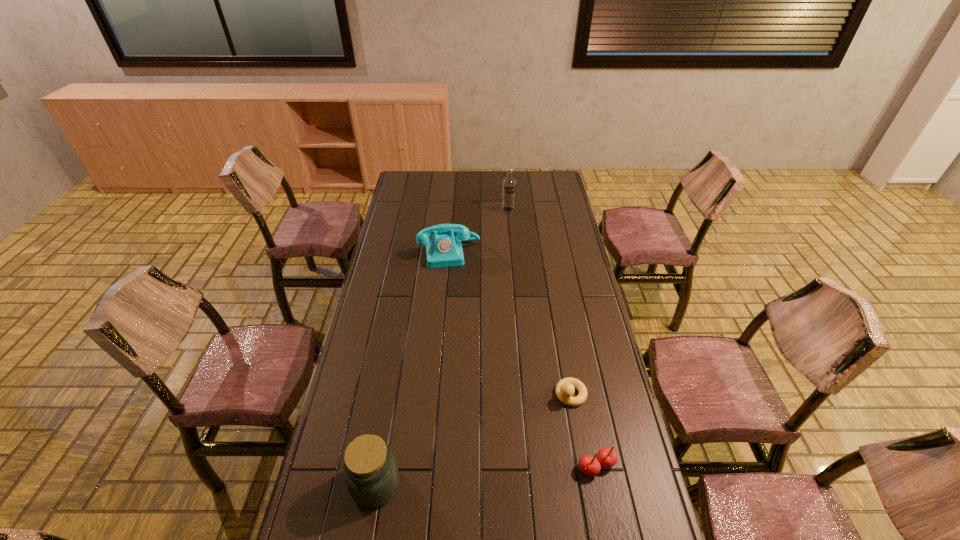
Locate an element on the screen. This screenshot has width=960, height=540. jar is located at coordinates (371, 474).

The image size is (960, 540). What are the coordinates of `cherry` in the screenshot? It's located at (607, 457).

The height and width of the screenshot is (540, 960). I want to click on the second farthest object, so click(x=444, y=249).

This screenshot has height=540, width=960. Find the location of `the farthest object`. the farthest object is located at coordinates (508, 197).

The width and height of the screenshot is (960, 540). Find the location of `the third object from right to left`. the third object from right to left is located at coordinates (508, 197).

Locate an element on the screen. the shortest object is located at coordinates (564, 390).

At what (x,y) coordinates should I click in order to perform the action: click on the third nearest object. Please return your answer as a coordinate pair (x, y). Looking at the image, I should click on (564, 390).

Where is `free region located 0.330m on the right of the jar`? The image size is (960, 540). free region located 0.330m on the right of the jar is located at coordinates (519, 484).

Locate an element on the screen. free space located 0.170m on the back of the cherry is located at coordinates (584, 402).

At what (x,y) coordinates should I click in order to perform the action: click on free space located 0.300m on the dial of the fourth nearest object. Please return your answer as a coordinate pair (x, y). Looking at the image, I should click on (460, 319).